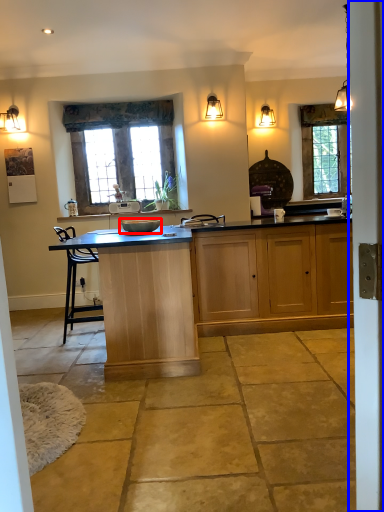
Question: Which of the following is the closest to the observer, sink (highlighted by a red box) or screen door (highlighted by a blue box)?

Choices:
 (A) sink
 (B) screen door

Answer: (B)